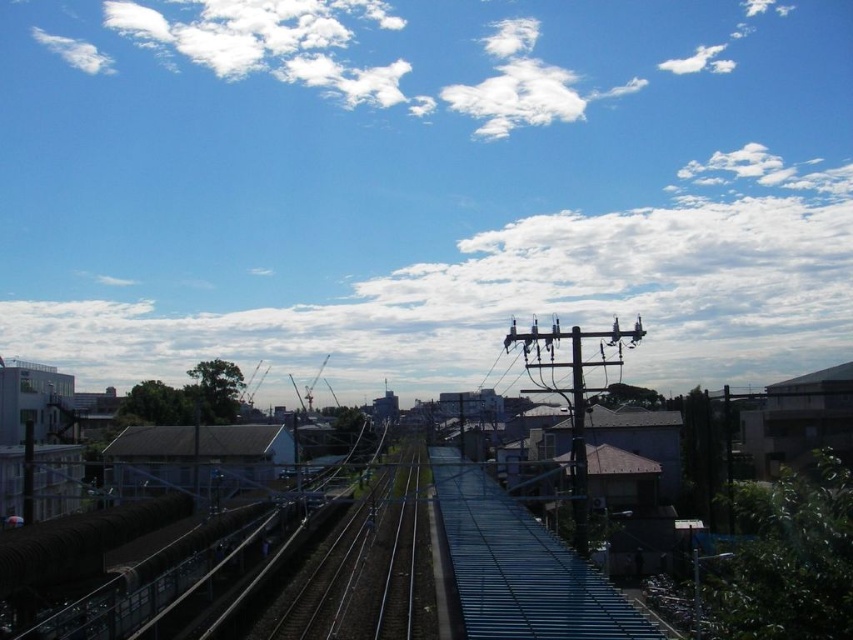
You are a photographer trying to capture the metallic gray power line at center and the white fluffy cloud at upper left in the same frame. Which object will appear smaller in the photo?

The metallic gray power line at center will appear smaller in the photo because it is smaller than the white fluffy cloud at upper left.

You are standing at the point marked as point (364, 570). Which object is directly beneath you?

The metallic blue train track at center is located at point (364, 570), so it is directly beneath you.

You are a maintenance worker checking the railway system. You notice the metallic blue train track at center and the metallic gray power line at center. Which object is located above the other?

The metallic gray power line at center is above the metallic blue train track at center.